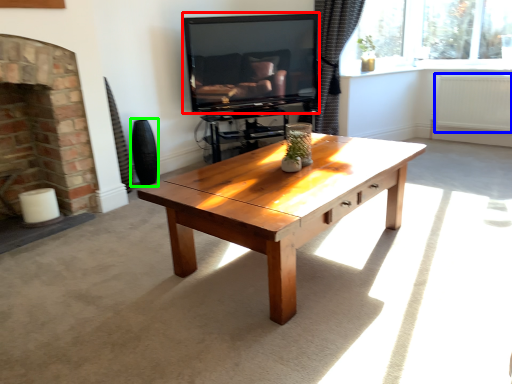
Question: Estimate the real-world distances between objects in this image. Which object is closer to television (highlighted by a red box), radiator (highlighted by a blue box) or vase (highlighted by a green box)?

Choices:
 (A) radiator
 (B) vase

Answer: (B)